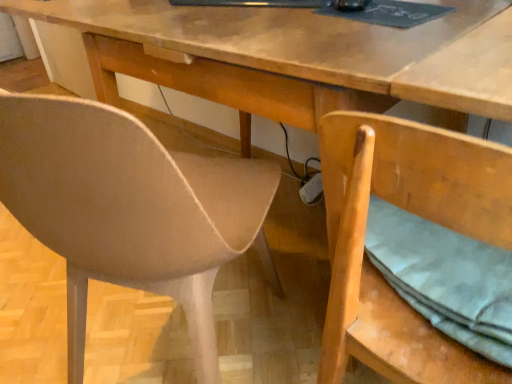
Identify the location of free space to the left of matte beige chair at left, arranged as the 1th chair when viewed from the left. The width and height of the screenshot is (512, 384). pyautogui.click(x=56, y=315).